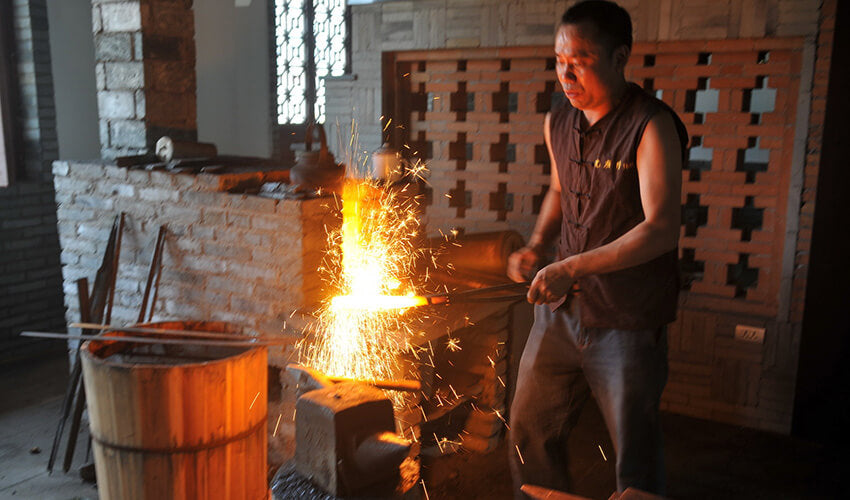
Locate an element on the screen. pillar is located at coordinates (129, 96).